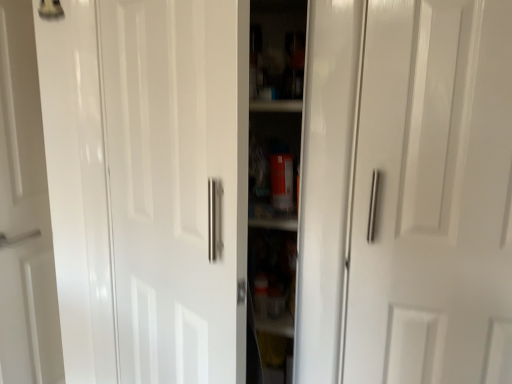
What do you see at coordinates (148, 186) in the screenshot? The image size is (512, 384). I see `white glossy door at center, the 2th door viewed from the right` at bounding box center [148, 186].

Image resolution: width=512 pixels, height=384 pixels. I want to click on white glossy door at center, the 2th door viewed from the right, so click(x=148, y=186).

Locate an element on the screen. This screenshot has width=512, height=384. white glossy door handle at right, which is the second door from left to right is located at coordinates (433, 196).

The width and height of the screenshot is (512, 384). Describe the element at coordinates (433, 196) in the screenshot. I see `white glossy door handle at right, the 1th door viewed from the right` at that location.

You are a GUI agent. You are given a task and a screenshot of the screen. Output one action in this format:
    pyautogui.click(x=<x>, y=<y>)
    Task: Click on the white glossy door at center, acting as the first door starting from the left
    
    Given the screenshot: What is the action you would take?
    [x=148, y=186]

In the image, is white glossy door at center, the 2th door viewed from the right, on the left side or the right side of white glossy door handle at right, which is the second door from left to right?

In the image, white glossy door at center, the 2th door viewed from the right, appears on the left side of white glossy door handle at right, which is the second door from left to right.

In the image, is white glossy door at center, acting as the first door starting from the left, positioned in front of or behind white glossy door handle at right, the 1th door viewed from the right?

white glossy door at center, acting as the first door starting from the left, is positioned closer to the viewer than white glossy door handle at right, the 1th door viewed from the right.

Which point is more forward, (98, 141) or (398, 259)?

The point (398, 259) is more forward.

Consider the image. From the image's perspective, would you say white glossy door at center, acting as the first door starting from the left, is positioned over white glossy door handle at right, the 1th door viewed from the right?

No, from the image's perspective, white glossy door at center, acting as the first door starting from the left, is not above white glossy door handle at right, the 1th door viewed from the right.

From a real-world perspective, is white glossy door at center, acting as the first door starting from the left, beneath white glossy door handle at right, which is the second door from left to right?

Yes, from a real-world perspective, white glossy door at center, acting as the first door starting from the left, is under white glossy door handle at right, which is the second door from left to right.

Which of these two, white glossy door at center, acting as the first door starting from the left, or white glossy door handle at right, the 1th door viewed from the right, is thinner?

With smaller width is white glossy door at center, acting as the first door starting from the left.

Can you confirm if white glossy door at center, the 2th door viewed from the right, is shorter than white glossy door handle at right, which is the second door from left to right?

In fact, white glossy door at center, the 2th door viewed from the right, may be taller than white glossy door handle at right, which is the second door from left to right.

Looking at the image, does white glossy door at center, the 2th door viewed from the right, seem bigger or smaller compared to white glossy door handle at right, which is the second door from left to right?

Clearly, white glossy door at center, the 2th door viewed from the right, is larger in size than white glossy door handle at right, which is the second door from left to right.

Is white glossy door at center, acting as the first door starting from the left, spatially inside white glossy door handle at right, the 1th door viewed from the right, or outside of it?

white glossy door at center, acting as the first door starting from the left, cannot be found inside white glossy door handle at right, the 1th door viewed from the right.

Is white glossy door at center, acting as the first door starting from the left, far away from white glossy door handle at right, the 1th door viewed from the right?

white glossy door at center, acting as the first door starting from the left, is actually quite close to white glossy door handle at right, the 1th door viewed from the right.

Is white glossy door handle at right, which is the second door from left to right, at the back of white glossy door at center, the 2th door viewed from the right?

No, white glossy door at center, the 2th door viewed from the right, is not facing away from white glossy door handle at right, which is the second door from left to right.

Image resolution: width=512 pixels, height=384 pixels. Find the location of `door below the white glossy door handle at right, the 1th door viewed from the right (from the image's perspective)`. door below the white glossy door handle at right, the 1th door viewed from the right (from the image's perspective) is located at coordinates (148, 186).

Which is more to the left, white glossy door handle at right, which is the second door from left to right, or white glossy door at center, acting as the first door starting from the left?

From the viewer's perspective, white glossy door at center, acting as the first door starting from the left, appears more on the left side.

Does white glossy door handle at right, which is the second door from left to right, come behind white glossy door at center, the 2th door viewed from the right?

Yes, white glossy door handle at right, which is the second door from left to right, is further from the viewer.

Which point is more forward, [437,182] or [138,352]?

Point [437,182]

From the image's perspective, is white glossy door handle at right, the 1th door viewed from the right, located above or below white glossy door at center, acting as the first door starting from the left?

From the image's perspective, white glossy door handle at right, the 1th door viewed from the right, appears above white glossy door at center, acting as the first door starting from the left.

From a real-world perspective, which object stands above the other?

white glossy door handle at right, which is the second door from left to right, from a real-world perspective.

Which of these two, white glossy door handle at right, which is the second door from left to right, or white glossy door at center, the 2th door viewed from the right, is wider?

white glossy door handle at right, which is the second door from left to right.

Is white glossy door handle at right, the 1th door viewed from the right, shorter than white glossy door at center, acting as the first door starting from the left?

Indeed, white glossy door handle at right, the 1th door viewed from the right, has a lesser height compared to white glossy door at center, acting as the first door starting from the left.

Does white glossy door handle at right, which is the second door from left to right, have a larger size compared to white glossy door at center, acting as the first door starting from the left?

No.

Which is correct: white glossy door handle at right, the 1th door viewed from the right, is inside white glossy door at center, acting as the first door starting from the left, or outside of it?

white glossy door handle at right, the 1th door viewed from the right, is located beyond the bounds of white glossy door at center, acting as the first door starting from the left.

Does white glossy door handle at right, which is the second door from left to right, touch white glossy door at center, acting as the first door starting from the left?

No, white glossy door handle at right, which is the second door from left to right, is not touching white glossy door at center, acting as the first door starting from the left.

Is white glossy door handle at right, the 1th door viewed from the right, facing away from white glossy door at center, acting as the first door starting from the left?

No, white glossy door at center, acting as the first door starting from the left, is not at the back of white glossy door handle at right, the 1th door viewed from the right.

How distant is white glossy door handle at right, which is the second door from left to right, from white glossy door at center, the 2th door viewed from the right?

white glossy door handle at right, which is the second door from left to right, is 22.87 inches from white glossy door at center, the 2th door viewed from the right.

Locate an element on the screen. door above the white glossy door at center, acting as the first door starting from the left (from the image's perspective) is located at coordinates (433, 196).

The width and height of the screenshot is (512, 384). What are the coordinates of `door lying above the white glossy door at center, the 2th door viewed from the right (from the image's perspective)` in the screenshot? It's located at (433, 196).

Locate an element on the screen. Image resolution: width=512 pixels, height=384 pixels. door lying in front of the white glossy door handle at right, the 1th door viewed from the right is located at coordinates (148, 186).